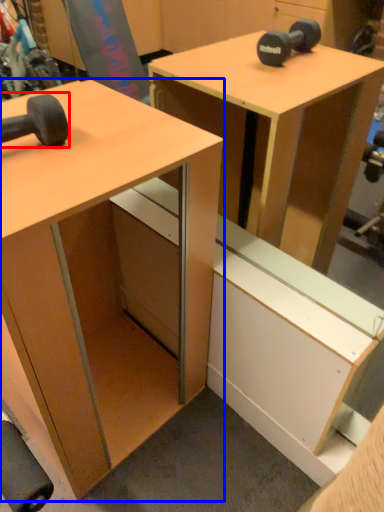
Question: Which object is further to the camera taking this photo, dumbbell (highlighted by a red box) or desk (highlighted by a blue box)?

Choices:
 (A) dumbbell
 (B) desk

Answer: (A)